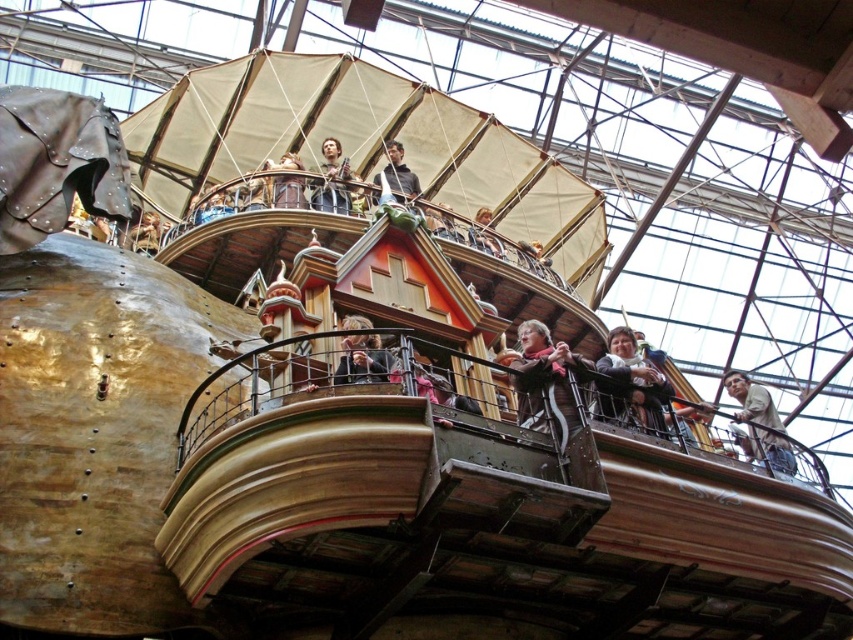
Who is more forward, (619, 360) or (375, 177)?

Positioned in front is point (619, 360).

Is point (636, 412) closer to camera compared to point (373, 180)?

Yes, point (636, 412) is in front of point (373, 180).

You are a GUI agent. You are given a task and a screenshot of the screen. Output one action in this format:
    pyautogui.click(x=<x>, y=<y>)
    Task: Click on the matte brown jacket at lower right
    This screenshot has height=640, width=853.
    Given the screenshot: What is the action you would take?
    pyautogui.click(x=631, y=384)

Does matte brown coat at center appear over matte gray jacket at upper center?

No.

Can you confirm if matte brown coat at center is positioned to the right of matte gray jacket at upper center?

Yes, matte brown coat at center is to the right of matte gray jacket at upper center.

Is point (576, 428) closer to camera compared to point (376, 177)?

Yes.

Find the location of a particular element. Image resolution: width=853 pixels, height=640 pixels. matte brown coat at center is located at coordinates (544, 381).

Does point (341, 348) come behind point (486, 212)?

No, (341, 348) is in front of (486, 212).

Does matte brown jacket at center appear over golden metallic ship at upper center?

No.

You are a GUI agent. You are given a task and a screenshot of the screen. Output one action in this format:
    pyautogui.click(x=<x>, y=<y>)
    Task: Click on the matte brown jacket at center
    This screenshot has height=640, width=853.
    Given the screenshot: What is the action you would take?
    pyautogui.click(x=363, y=360)